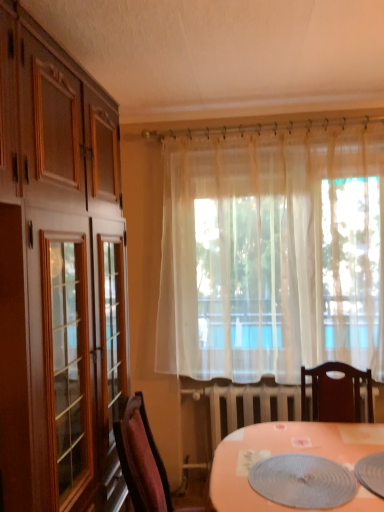
What do you see at coordinates (272, 253) in the screenshot? Image resolution: width=384 pixels, height=512 pixels. I see `sheer white curtain at center` at bounding box center [272, 253].

At what (x,y) coordinates should I click in order to perform the action: click on velvet burgundy chair at lower left. Please return your answer as a coordinate pair (x, y). Looking at the image, I should click on (141, 458).

What do you see at coordinates (303, 481) in the screenshot? I see `textured gray placemat at lower center` at bounding box center [303, 481].

The width and height of the screenshot is (384, 512). I want to click on sheer white curtain at center, so click(x=272, y=253).

Between sheer white curtain at center and velvet burgundy chair at lower left, which one appears on the left side from the viewer's perspective?

velvet burgundy chair at lower left.

Is sheer white curtain at center wider than velvet burgundy chair at lower left?

No.

Is sheer white curtain at center aimed at velvet burgundy chair at lower left?

Yes, sheer white curtain at center is turned towards velvet burgundy chair at lower left.

From the picture: Looking at the image, does sheer white curtain at center seem bigger or smaller compared to velvet burgundy chair at lower left?

In the image, sheer white curtain at center appears to be larger than velvet burgundy chair at lower left.

From the image's perspective, would you say textured gray placemat at lower center is positioned over velvet burgundy chair at lower left?

Yes.

Measure the distance from textured gray placemat at lower center to velvet burgundy chair at lower left.

The distance of textured gray placemat at lower center from velvet burgundy chair at lower left is 20.95 inches.

Would you say textured gray placemat at lower center is outside velvet burgundy chair at lower left?

Yes, textured gray placemat at lower center is located beyond the bounds of velvet burgundy chair at lower left.

Between point (316, 461) and point (136, 426), which one is positioned in front?

Positioned in front is point (316, 461).

From the image's perspective, who appears lower, sheer white curtain at center or textured gray placemat at lower center?

From the image's view, textured gray placemat at lower center is below.

Is point (293, 304) more distant than point (328, 498)?

Yes.

How different are the orientations of sheer white curtain at center and textured gray placemat at lower center in degrees?

The angle between the facing direction of sheer white curtain at center and the facing direction of textured gray placemat at lower center is 0.107 degrees.

The height and width of the screenshot is (512, 384). I want to click on platter on the left of sheer white curtain at center, so click(303, 481).

From a real-world perspective, is velvet burgundy chair at lower left positioned above or below textured gray placemat at lower center?

From a real-world perspective, velvet burgundy chair at lower left is physically below textured gray placemat at lower center.

Considering the relative positions of velvet burgundy chair at lower left and textured gray placemat at lower center in the image provided, is velvet burgundy chair at lower left to the left or to the right of textured gray placemat at lower center?

In the image, velvet burgundy chair at lower left appears on the left side of textured gray placemat at lower center.

Does velvet burgundy chair at lower left turn towards textured gray placemat at lower center?

Yes, velvet burgundy chair at lower left is facing textured gray placemat at lower center.

Does textured gray placemat at lower center turn towards sheer white curtain at center?

No, textured gray placemat at lower center does not turn towards sheer white curtain at center.

Considering the points (280, 455) and (248, 177), which point is behind, point (280, 455) or point (248, 177)?

The point (248, 177) is more distant.

Between textured gray placemat at lower center and sheer white curtain at center, which one has more height?

Standing taller between the two is sheer white curtain at center.

Does textured gray placemat at lower center come behind sheer white curtain at center?

No, textured gray placemat at lower center is in front of sheer white curtain at center.

Are velvet burgundy chair at lower left and sheer white curtain at center beside each other?

They are not placed beside each other.

At what (x,y) coordinates should I click in order to perform the action: click on curtain behind the velvet burgundy chair at lower left. Please return your answer as a coordinate pair (x, y). This screenshot has height=512, width=384. Looking at the image, I should click on [x=272, y=253].

Is velvet burgundy chair at lower left facing away from sheer white curtain at center?

velvet burgundy chair at lower left does not have its back to sheer white curtain at center.

Looking at this image, considering the relative sizes of velvet burgundy chair at lower left and sheer white curtain at center in the image provided, is velvet burgundy chair at lower left taller than sheer white curtain at center?

No, velvet burgundy chair at lower left is not taller than sheer white curtain at center.

Locate an element on the screen. chair below the sheer white curtain at center (from the image's perspective) is located at coordinates (141, 458).

Identify the location of chair below the textured gray placemat at lower center (from a real-world perspective). (141, 458).

Considering their positions, is textured gray placemat at lower center positioned further to sheer white curtain at center than velvet burgundy chair at lower left?

The object further to sheer white curtain at center is velvet burgundy chair at lower left.

Looking at this image, from the image, which object appears to be farther from velvet burgundy chair at lower left, sheer white curtain at center or textured gray placemat at lower center?

The object further to velvet burgundy chair at lower left is sheer white curtain at center.

When comparing their distances from sheer white curtain at center, does velvet burgundy chair at lower left or textured gray placemat at lower center seem closer?

textured gray placemat at lower center.

Based on their spatial positions, is sheer white curtain at center or velvet burgundy chair at lower left closer to textured gray placemat at lower center?

velvet burgundy chair at lower left is closer to textured gray placemat at lower center.

Estimate the real-world distances between objects in this image. Which object is closer to velvet burgundy chair at lower left, textured gray placemat at lower center or sheer white curtain at center?

textured gray placemat at lower center is closer to velvet burgundy chair at lower left.

Based on their spatial positions, is velvet burgundy chair at lower left or sheer white curtain at center further from textured gray placemat at lower center?

sheer white curtain at center.

Where is `chair between textured gray placemat at lower center and sheer white curtain at center from front to back`? Image resolution: width=384 pixels, height=512 pixels. chair between textured gray placemat at lower center and sheer white curtain at center from front to back is located at coordinates (141, 458).